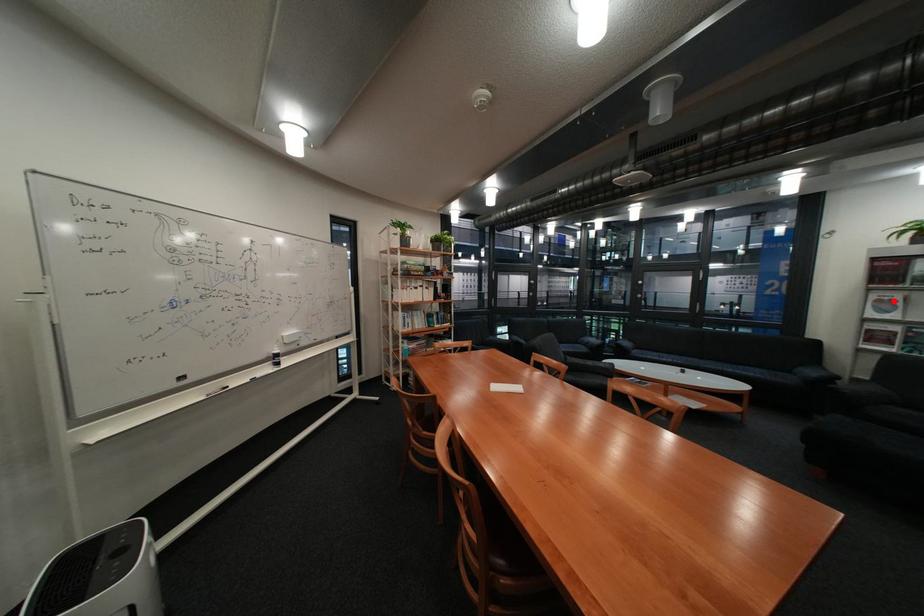
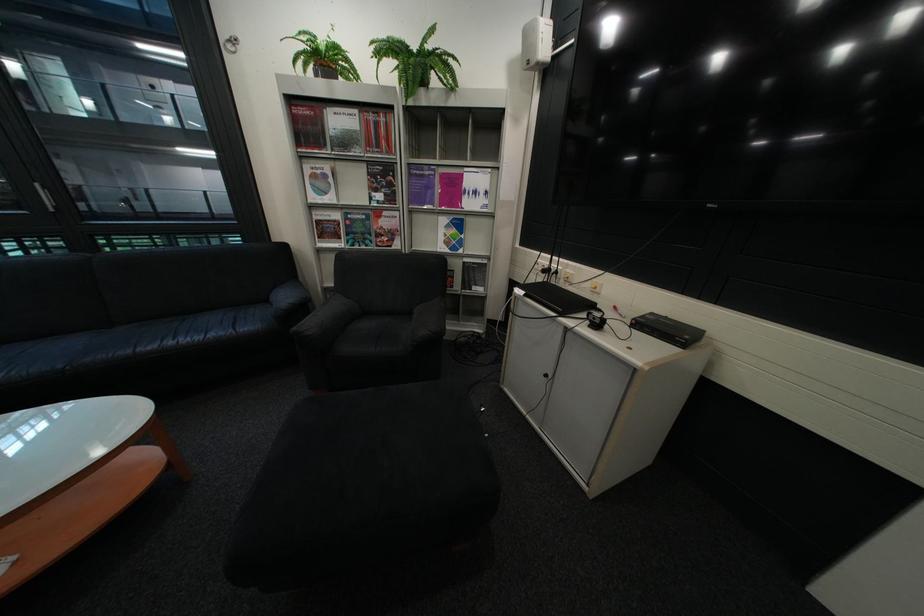
In the second image, find the point that corresponds to the highlighted location in the first image.

(329, 177)